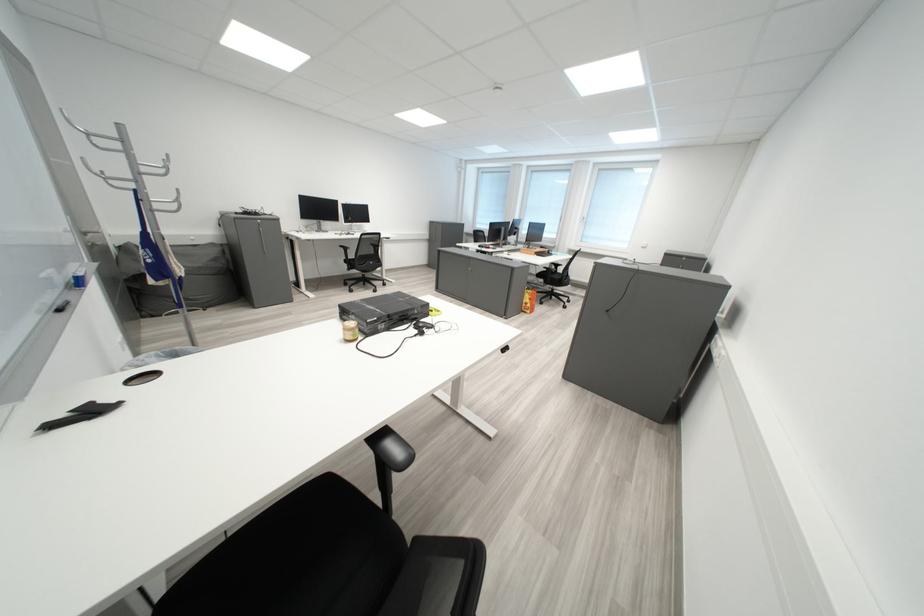
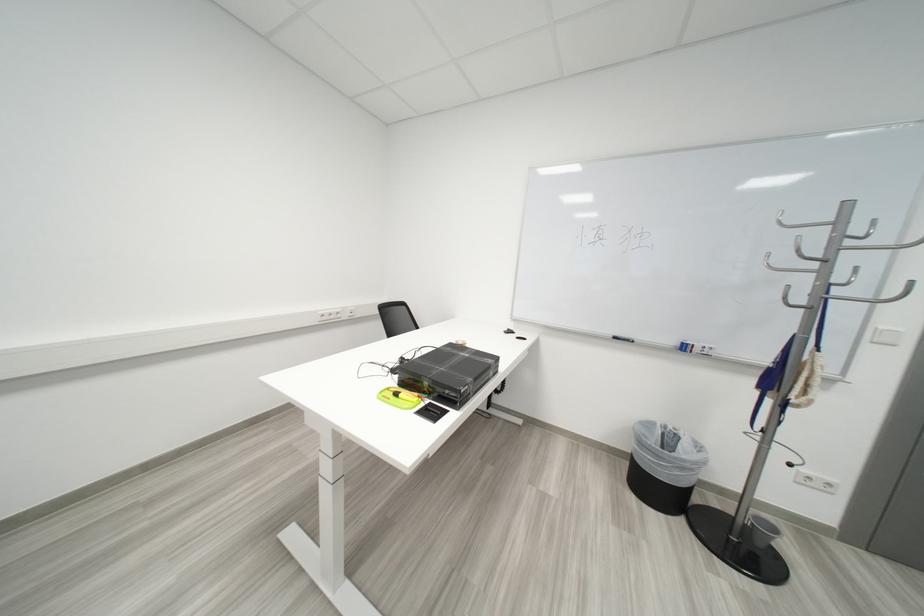
Question: I am providing you with two images of the same scene from different viewpoints. Which of the following objects are not visible in image2?

Choices:
 (A) whiteboard eraser
 (B) black wrapped box
 (C) white water flask
 (D) chair armrest

Answer: (D)